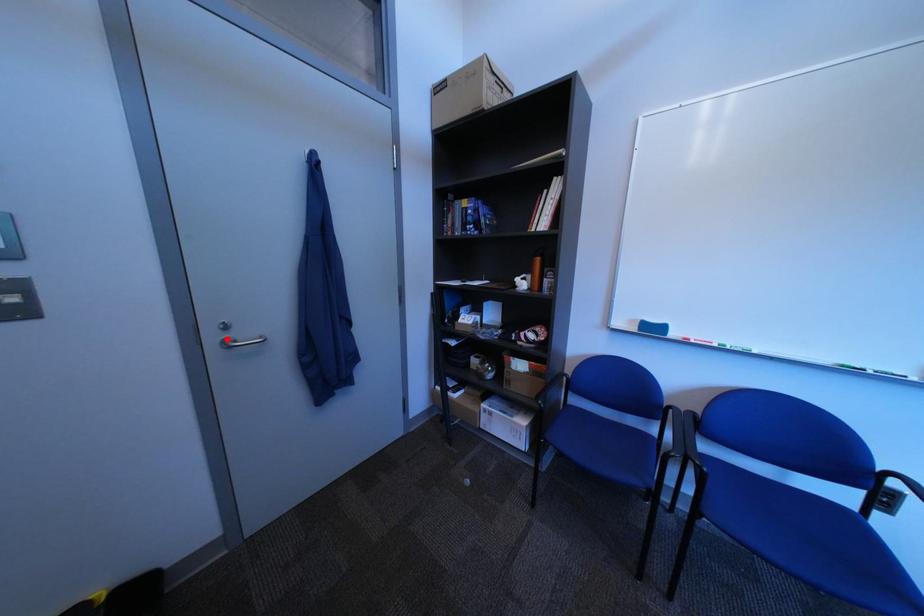
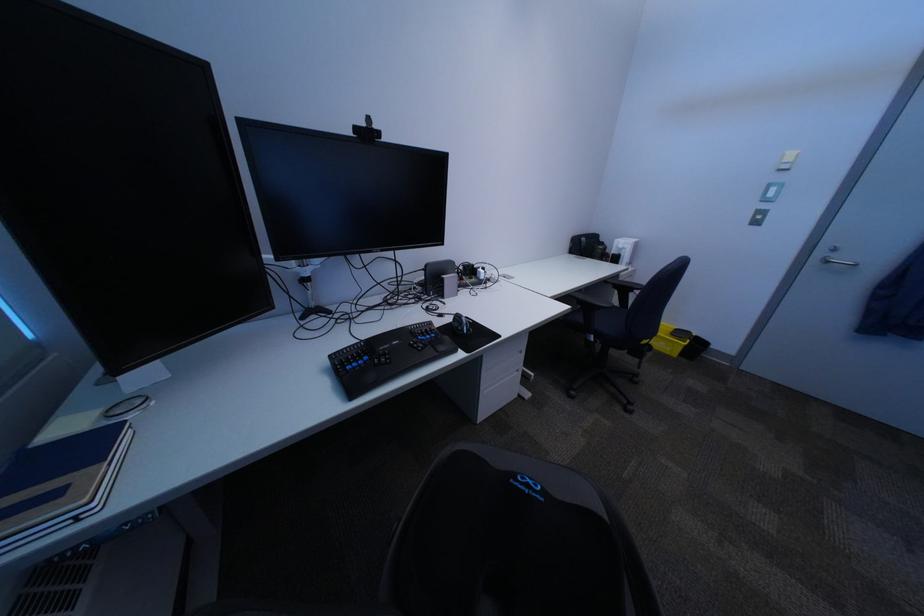
The point at the highlighted location is marked in the first image. Where is the corresponding point in the second image?

(834, 254)